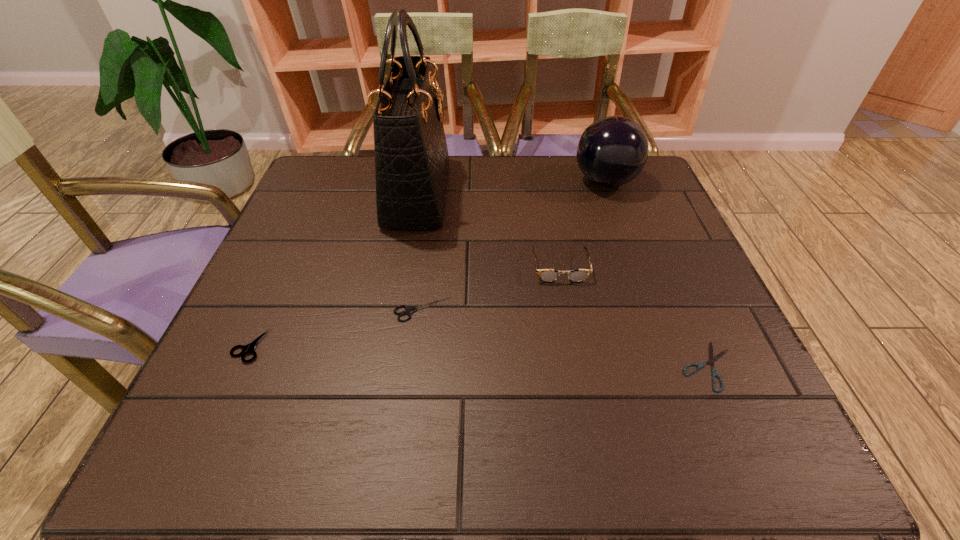
Where is `object that is at the left edge`? The height and width of the screenshot is (540, 960). object that is at the left edge is located at coordinates (249, 348).

Where is `bowling ball at the right edge`? bowling ball at the right edge is located at coordinates (612, 151).

Image resolution: width=960 pixels, height=540 pixels. Find the location of `shears at the right edge`. shears at the right edge is located at coordinates (714, 373).

Where is `object at the far right corner`? The image size is (960, 540). object at the far right corner is located at coordinates (612, 151).

You are a GUI agent. You are given a task and a screenshot of the screen. Output one action in this format:
    pyautogui.click(x=<x>, y=<y>)
    Task: Click on the free space at the far edge of the desktop
    
    Given the screenshot: What is the action you would take?
    pyautogui.click(x=479, y=159)

The image size is (960, 540). I want to click on vacant area at the near edge, so click(x=520, y=440).

This screenshot has height=540, width=960. In the image, there is a desktop. In order to click on vacant space at the left edge in this screenshot , I will do `click(336, 246)`.

At what (x,y) coordinates should I click in order to perform the action: click on vacant space at the right edge of the desktop. Please return your answer as a coordinate pair (x, y). This screenshot has height=540, width=960. Looking at the image, I should click on (747, 381).

Where is `vacant space at the far left corner of the desktop`? vacant space at the far left corner of the desktop is located at coordinates (354, 201).

The image size is (960, 540). In order to click on vacant space at the near left corner in this screenshot , I will do `click(204, 461)`.